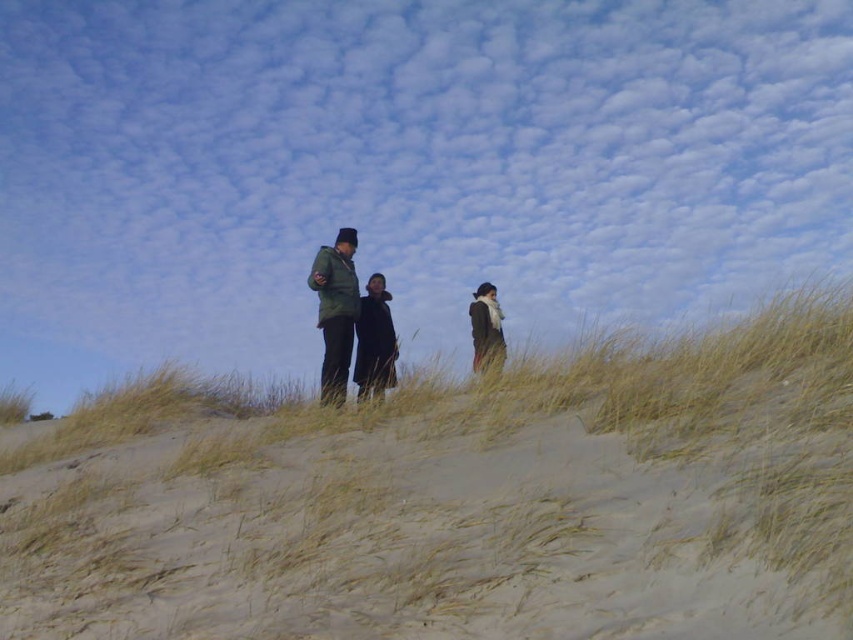
Question: Which object is positioned closest to the dark green jacket at center?

Choices:
 (A) green matte jacket at center
 (B) dry grass at center

Answer: (A)

Question: Can you confirm if dry grass at center is positioned above green matte jacket at center?

Choices:
 (A) no
 (B) yes

Answer: (A)

Question: Which of these objects is positioned farthest from the dark green jacket at center?

Choices:
 (A) green matte jacket at center
 (B) dry grass at center
 (C) dark brown scarf at right

Answer: (B)

Question: Which is nearer to the green matte jacket at center?

Choices:
 (A) dry grass at center
 (B) dark green jacket at center
 (C) dark brown scarf at right

Answer: (B)

Question: Does green matte jacket at center have a greater width compared to dark green jacket at center?

Choices:
 (A) no
 (B) yes

Answer: (B)

Question: Is green matte jacket at center smaller than dark green jacket at center?

Choices:
 (A) yes
 (B) no

Answer: (B)